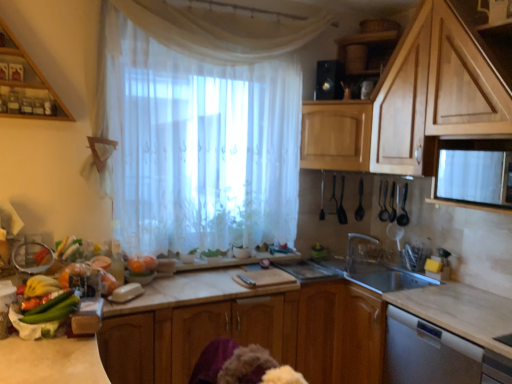
In order to face black plastic spoons at upper right, marked as the second appliance in a right-to-left arrangement, should I rotate leftwards or rightwards?

It's best to rotate right around 16.752 degrees.

The width and height of the screenshot is (512, 384). What do you see at coordinates (392, 203) in the screenshot?
I see `black plastic utensils at upper right, the first appliance when ordered from right to left` at bounding box center [392, 203].

What is the approximate height of wooden cabinet at upper right, which ranks as the second cabinetry in bottom-to-top order?

The height of wooden cabinet at upper right, which ranks as the second cabinetry in bottom-to-top order, is 19.36 inches.

Describe the element at coordinates (336, 135) in the screenshot. I see `wooden cabinet at upper right, which ranks as the second cabinetry in bottom-to-top order` at that location.

At what (x,y) coordinates should I click in order to perform the action: click on wooden cabinet at center, which is counted as the 4th cabinetry, starting from the top. Please return your answer as a coordinate pair (x, y). Looking at the image, I should click on (255, 335).

Describe the element at coordinates (255, 335) in the screenshot. I see `wooden cabinet at center, the 1th cabinetry positioned from the bottom` at that location.

The width and height of the screenshot is (512, 384). Describe the element at coordinates (412, 103) in the screenshot. I see `wooden cabinet at upper right, the second cabinetry from the top` at that location.

Identify the location of black plastic spoons at upper right, marked as the second appliance in a right-to-left arrangement. (383, 203).

The image size is (512, 384). Find the location of `microwave on the right of black plastic spoon at right, the fifth appliance viewed from the left`. microwave on the right of black plastic spoon at right, the fifth appliance viewed from the left is located at coordinates (474, 173).

Consider the image. Can you tell me how much black plastic spoon at right, the fifth appliance viewed from the left, and black matte microwave at upper right differ in facing direction?

The angular difference between black plastic spoon at right, the fifth appliance viewed from the left, and black matte microwave at upper right is 45 degrees.

Is the position of black plastic spoon at right, the fifth appliance viewed from the left, more distant than that of black matte microwave at upper right?

Yes, black plastic spoon at right, the fifth appliance viewed from the left, is further from the camera.

Is black plastic spoon at right, the fifth appliance viewed from the left, wider or thinner than black matte microwave at upper right?

Considering their sizes, black plastic spoon at right, the fifth appliance viewed from the left, looks slimmer than black matte microwave at upper right.

Can you see wooden cabinet at upper right, which ranks as the second cabinetry in bottom-to-top order, touching silver metallic faucet at lower center?

No, wooden cabinet at upper right, which ranks as the second cabinetry in bottom-to-top order, is not with silver metallic faucet at lower center.

This screenshot has width=512, height=384. I want to click on tap below the wooden cabinet at upper right, the 3th cabinetry from the top (from the image's perspective), so click(x=351, y=247).

From the image's perspective, which is below, wooden cabinet at upper right, which ranks as the second cabinetry in bottom-to-top order, or silver metallic faucet at lower center?

From the image's view, silver metallic faucet at lower center is below.

In the scene shown: Is silver metallic faucet at lower center at the back of wooden cabinet at upper right, the 3th cabinetry from the top?

wooden cabinet at upper right, the 3th cabinetry from the top, is not turned away from silver metallic faucet at lower center.

How many degrees apart are the facing directions of black plastic spoons at upper right, arranged as the sixth appliance when viewed from the left, and wooden cabinet at upper right, the 3th cabinetry from the top?

24.8 degrees.

Is point (386, 219) less distant than point (322, 153)?

No, (386, 219) is further to viewer.

Which object is more forward, black plastic spoons at upper right, arranged as the sixth appliance when viewed from the left, or wooden cabinet at upper right, which ranks as the second cabinetry in bottom-to-top order?

wooden cabinet at upper right, which ranks as the second cabinetry in bottom-to-top order, is closer to the camera.

Based on the photo, from the image's perspective, is black plastic spoons at upper right, arranged as the sixth appliance when viewed from the left, above or below wooden cabinet at upper right, which ranks as the second cabinetry in bottom-to-top order?

Based on their image positions, black plastic spoons at upper right, arranged as the sixth appliance when viewed from the left, is located beneath wooden cabinet at upper right, which ranks as the second cabinetry in bottom-to-top order.

Which appliance is the 4th one when counting from the back of the white sheer curtain at center? Please provide its 2D coordinates.

[(360, 202)]

Consider the image. From the image's perspective, which one is positioned lower, white sheer curtain at center or black plastic spoon at right, the fifth appliance viewed from the left?

black plastic spoon at right, the fifth appliance viewed from the left, appears lower in the image.

Which is more to the right, white sheer curtain at center or black plastic spoon at right, placed as the third appliance when sorted from right to left?

Positioned to the right is black plastic spoon at right, placed as the third appliance when sorted from right to left.

How many degrees apart are the facing directions of white sheer curtain at center and black plastic spoon at right, placed as the third appliance when sorted from right to left?

The angular difference between white sheer curtain at center and black plastic spoon at right, placed as the third appliance when sorted from right to left, is 46 degrees.

From a real-world perspective, relative to black plastic spoon at upper center, the first appliance in the left-to-right sequence, is black plastic spoons at upper right, arranged as the sixth appliance when viewed from the left, vertically above or below?

black plastic spoons at upper right, arranged as the sixth appliance when viewed from the left, is above black plastic spoon at upper center, the first appliance in the left-to-right sequence.

Are black plastic spoons at upper right, marked as the second appliance in a right-to-left arrangement, and black plastic spoon at upper center, arranged as the 7th appliance when viewed from the right, far apart?

No.

Is black plastic spoons at upper right, arranged as the sixth appliance when viewed from the left, thinner than black plastic spoon at upper center, arranged as the 7th appliance when viewed from the right?

Correct, the width of black plastic spoons at upper right, arranged as the sixth appliance when viewed from the left, is less than that of black plastic spoon at upper center, arranged as the 7th appliance when viewed from the right.

Looking at this image, how much distance is there between black plastic spoon at right, placed as the third appliance when sorted from right to left, and white sheer curtain at center?

The distance of black plastic spoon at right, placed as the third appliance when sorted from right to left, from white sheer curtain at center is 4.28 feet.

Could you tell me if black plastic spoon at right, the fifth appliance viewed from the left, is facing white sheer curtain at center?

No, black plastic spoon at right, the fifth appliance viewed from the left, is not aimed at white sheer curtain at center.

From the image's perspective, which is above, black plastic spoon at right, the fifth appliance viewed from the left, or white sheer curtain at center?

white sheer curtain at center is shown above in the image.

Locate an element on the screen. curtain above the black plastic spoon at right, placed as the third appliance when sorted from right to left (from a real-world perspective) is located at coordinates pos(196,145).

How many degrees apart are the facing directions of black plastic spoons at upper right, which ranks as the 4th appliance in left-to-right order, and black plastic speaker at upper center, the 2th appliance from the left?

There is a 0.385-degree angle between the facing directions of black plastic spoons at upper right, which ranks as the 4th appliance in left-to-right order, and black plastic speaker at upper center, the 2th appliance from the left.

Is black plastic spoons at upper right, arranged as the 4th appliance when viewed from the right, wider than black plastic speaker at upper center, which is the sixth appliance in right-to-left order?

In fact, black plastic spoons at upper right, arranged as the 4th appliance when viewed from the right, might be narrower than black plastic speaker at upper center, which is the sixth appliance in right-to-left order.

Based on the photo, is black plastic spoons at upper right, which ranks as the 4th appliance in left-to-right order, to the left of black plastic speaker at upper center, which is the sixth appliance in right-to-left order, from the viewer's perspective?

Incorrect, black plastic spoons at upper right, which ranks as the 4th appliance in left-to-right order, is not on the left side of black plastic speaker at upper center, which is the sixth appliance in right-to-left order.

Considering the sizes of objects black plastic spoons at upper right, arranged as the 4th appliance when viewed from the right, and black plastic speaker at upper center, the 2th appliance from the left, in the image provided, who is shorter, black plastic spoons at upper right, arranged as the 4th appliance when viewed from the right, or black plastic speaker at upper center, the 2th appliance from the left,?

black plastic speaker at upper center, the 2th appliance from the left, is shorter.

You are a GUI agent. You are given a task and a screenshot of the screen. Output one action in this format:
    pyautogui.click(x=<x>, y=<y>)
    Task: Click on the appliance that is the 4th object located behind the black matte microwave at upper right
    The height and width of the screenshot is (384, 512).
    Given the screenshot: What is the action you would take?
    pyautogui.click(x=360, y=202)

Identify the location of the 1st cabinetry to the left of the silver metallic faucet at lower center, counting from the anchor's position. Image resolution: width=512 pixels, height=384 pixels. (336, 135).

Which object lies further to the anchor point green matte cucumber at lower left, white sheer curtain at center or black plastic spoons at upper right, placed as the fifth appliance when sorted from right to left?

black plastic spoons at upper right, placed as the fifth appliance when sorted from right to left, is positioned further to the anchor green matte cucumber at lower left.

Considering their positions, is black plastic speaker at upper center, the 2th appliance from the left, positioned closer to marble countertop at center than wooden cabinet at upper right, which ranks as the second cabinetry in bottom-to-top order?

Based on the image, wooden cabinet at upper right, which ranks as the second cabinetry in bottom-to-top order, appears to be nearer to marble countertop at center.

Based on their spatial positions, is black matte microwave at upper right or marble countertop at center further from black plastic spoons at upper right, arranged as the sixth appliance when viewed from the left?

The object further to black plastic spoons at upper right, arranged as the sixth appliance when viewed from the left, is marble countertop at center.

Considering their positions, is wooden cabinet at upper right, the 3th cabinetry from the top, positioned further to silver metallic faucet at lower center than marble countertop at center?

The object further to silver metallic faucet at lower center is wooden cabinet at upper right, the 3th cabinetry from the top.

Consider the image. From the image, which object appears to be nearer to wooden cabinet at center, the 1th cabinetry positioned from the bottom, green matte cucumber at lower left or black plastic spoon at upper center, arranged as the 7th appliance when viewed from the right?

green matte cucumber at lower left is closer to wooden cabinet at center, the 1th cabinetry positioned from the bottom.

Considering their positions, is black plastic speaker at upper center, which is the sixth appliance in right-to-left order, positioned closer to black plastic spoons at upper right, which ranks as the 4th appliance in left-to-right order, than silver metallic faucet at lower center?

Based on the image, silver metallic faucet at lower center appears to be nearer to black plastic spoons at upper right, which ranks as the 4th appliance in left-to-right order.

Considering their positions, is black plastic speaker at upper center, which is the sixth appliance in right-to-left order, positioned further to black matte microwave at upper right than wooden cabinet at center, the 1th cabinetry positioned from the bottom?

black plastic speaker at upper center, which is the sixth appliance in right-to-left order, lies further to black matte microwave at upper right than the other object.

Looking at the image, which one is located closer to black plastic spoon at upper center, arranged as the 7th appliance when viewed from the right, wooden cabinet at upper left, the 4th cabinetry ordered from the bottom, or black plastic spoons at upper right, which ranks as the 4th appliance in left-to-right order?

black plastic spoons at upper right, which ranks as the 4th appliance in left-to-right order.

This screenshot has width=512, height=384. Identify the location of microwave between white marble countertop at lower right and black plastic spoons at upper right, arranged as the sixth appliance when viewed from the left, along the z-axis. (474, 173).

Identify the location of curtain between wooden cabinet at upper left, which is counted as the first cabinetry, starting from the top, and wooden cabinet at center, the 1th cabinetry positioned from the bottom, in the up-down direction. (196, 145).

Image resolution: width=512 pixels, height=384 pixels. Find the location of `tap between white sheer curtain at center and black matte microwave at upper right in the horizontal direction`. tap between white sheer curtain at center and black matte microwave at upper right in the horizontal direction is located at coordinates (351, 247).

At what (x,y) coordinates should I click in order to perform the action: click on tap located between marble countertop at center and black plastic spoons at upper right, arranged as the sixth appliance when viewed from the left, in the depth direction. Please return your answer as a coordinate pair (x, y). Looking at the image, I should click on (351, 247).